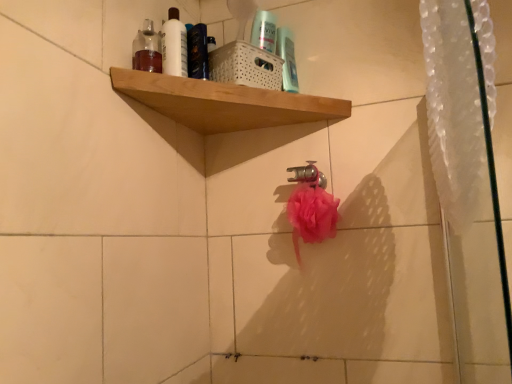
Question: From the image's perspective, is wooden shelf at upper center located above or below white glossy bottle at upper center?

Choices:
 (A) below
 (B) above

Answer: (A)

Question: Looking at the image, does wooden shelf at upper center seem bigger or smaller compared to white glossy bottle at upper center?

Choices:
 (A) big
 (B) small

Answer: (A)

Question: Estimate the real-world distances between objects in this image. Which object is farther from the clear plastic shower curtain at right?

Choices:
 (A) white glossy bottle at upper center
 (B) translucent plastic bottle at upper left
 (C) wooden shelf at upper center

Answer: (B)

Question: Which of these objects is positioned farthest from the clear plastic shower curtain at right?

Choices:
 (A) white glossy bottle at upper center
 (B) translucent plastic bottle at upper left
 (C) wooden shelf at upper center

Answer: (B)